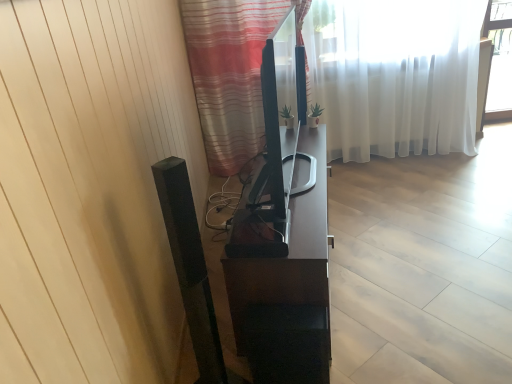
Question: Is white sheer curtain at upper center, which ranks as the 2th curtain in front-to-back order, looking in the opposite direction of striped fabric curtain at center, which ranks as the 2th curtain in back-to-front order?

Choices:
 (A) yes
 (B) no

Answer: (B)

Question: Does white sheer curtain at upper center, which ranks as the 2th curtain in front-to-back order, have a larger size compared to striped fabric curtain at center, which is counted as the first curtain, starting from the front?

Choices:
 (A) yes
 (B) no

Answer: (A)

Question: Would you consider white sheer curtain at upper center, marked as the 1th curtain in a back-to-front arrangement, to be distant from striped fabric curtain at center, which is counted as the first curtain, starting from the front?

Choices:
 (A) yes
 (B) no

Answer: (B)

Question: Can you see white sheer curtain at upper center, which ranks as the 2th curtain in front-to-back order, touching striped fabric curtain at center, which ranks as the 2th curtain in back-to-front order?

Choices:
 (A) no
 (B) yes

Answer: (A)

Question: Considering the relative sizes of white sheer curtain at upper center, which ranks as the 2th curtain in front-to-back order, and striped fabric curtain at center, which ranks as the 2th curtain in back-to-front order, in the image provided, is white sheer curtain at upper center, which ranks as the 2th curtain in front-to-back order, wider than striped fabric curtain at center, which ranks as the 2th curtain in back-to-front order,?

Choices:
 (A) yes
 (B) no

Answer: (B)

Question: In the image, is striped fabric curtain at center, which is counted as the first curtain, starting from the front, positioned in front of or behind satin black tv stand at center?

Choices:
 (A) behind
 (B) front

Answer: (B)

Question: In terms of height, does striped fabric curtain at center, which ranks as the 2th curtain in back-to-front order, look taller or shorter compared to satin black tv stand at center?

Choices:
 (A) tall
 (B) short

Answer: (A)

Question: Is striped fabric curtain at center, which is counted as the first curtain, starting from the front, bigger or smaller than satin black tv stand at center?

Choices:
 (A) small
 (B) big

Answer: (A)

Question: From a real-world perspective, is striped fabric curtain at center, which is counted as the first curtain, starting from the front, above or below satin black tv stand at center?

Choices:
 (A) above
 (B) below

Answer: (A)

Question: From the image's perspective, relative to white sheer curtain at upper center, marked as the 1th curtain in a back-to-front arrangement, is satin black tv stand at center above or below?

Choices:
 (A) below
 (B) above

Answer: (A)

Question: Considering the positions of point (324, 206) and point (312, 97), is point (324, 206) closer or farther from the camera than point (312, 97)?

Choices:
 (A) closer
 (B) farther

Answer: (A)

Question: From a real-world perspective, is satin black tv stand at center physically located above or below white sheer curtain at upper center, which ranks as the 2th curtain in front-to-back order?

Choices:
 (A) above
 (B) below

Answer: (B)

Question: Based on their positions, is satin black tv stand at center located to the left or right of white sheer curtain at upper center, which ranks as the 2th curtain in front-to-back order?

Choices:
 (A) left
 (B) right

Answer: (A)

Question: From a real-world perspective, is striped fabric curtain at center, which is counted as the first curtain, starting from the front, above or below white sheer curtain at upper center, marked as the 1th curtain in a back-to-front arrangement?

Choices:
 (A) above
 (B) below

Answer: (A)

Question: Is striped fabric curtain at center, which is counted as the first curtain, starting from the front, wider or thinner than white sheer curtain at upper center, which ranks as the 2th curtain in front-to-back order?

Choices:
 (A) wide
 (B) thin

Answer: (A)